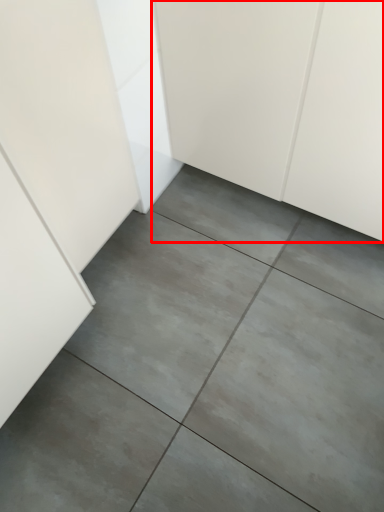
Question: Where is cabinetry (annotated by the red box) located in relation to concrete in the image?

Choices:
 (A) left
 (B) right

Answer: (B)